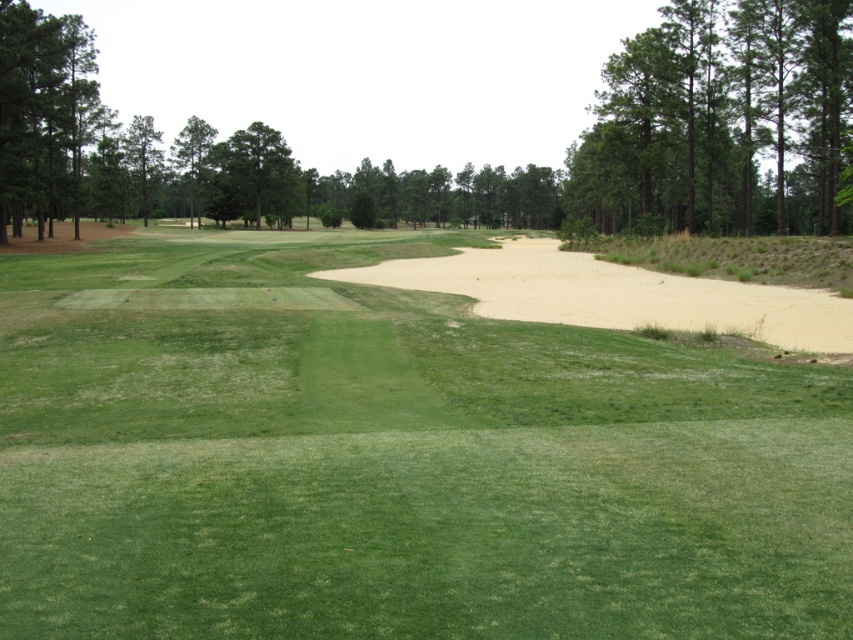
Based on the photo, who is positioned more to the left, green grassy fairway at center or tan sandy bunker at center?

From the viewer's perspective, green grassy fairway at center appears more on the left side.

Where is `green grassy fairway at center`? The width and height of the screenshot is (853, 640). green grassy fairway at center is located at coordinates (393, 460).

Is tan sandy bunker at center bigger than green leafy tree at upper left?

Actually, tan sandy bunker at center might be smaller than green leafy tree at upper left.

Which is behind, point (511, 250) or point (200, 154)?

The point (200, 154) is more distant.

What do you see at coordinates (614, 294) in the screenshot? I see `tan sandy bunker at center` at bounding box center [614, 294].

Locate an element on the screen. This screenshot has width=853, height=640. tan sandy bunker at center is located at coordinates (614, 294).

Who is positioned more to the right, green grassy fairway at center or green leafy tree at upper center?

green grassy fairway at center is more to the right.

Can you confirm if green grassy fairway at center is thinner than green leafy tree at upper center?

In fact, green grassy fairway at center might be wider than green leafy tree at upper center.

Between point (335, 454) and point (259, 131), which one is positioned in front?

Point (335, 454) is more forward.

This screenshot has height=640, width=853. Identify the location of green grassy fairway at center. (393, 460).